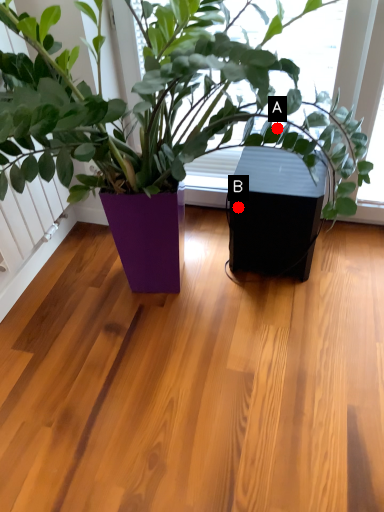
Question: Two points are circled on the image, labeled by A and B beside each circle. Which point is further to the camera?

Choices:
 (A) A is further
 (B) B is further

Answer: (B)